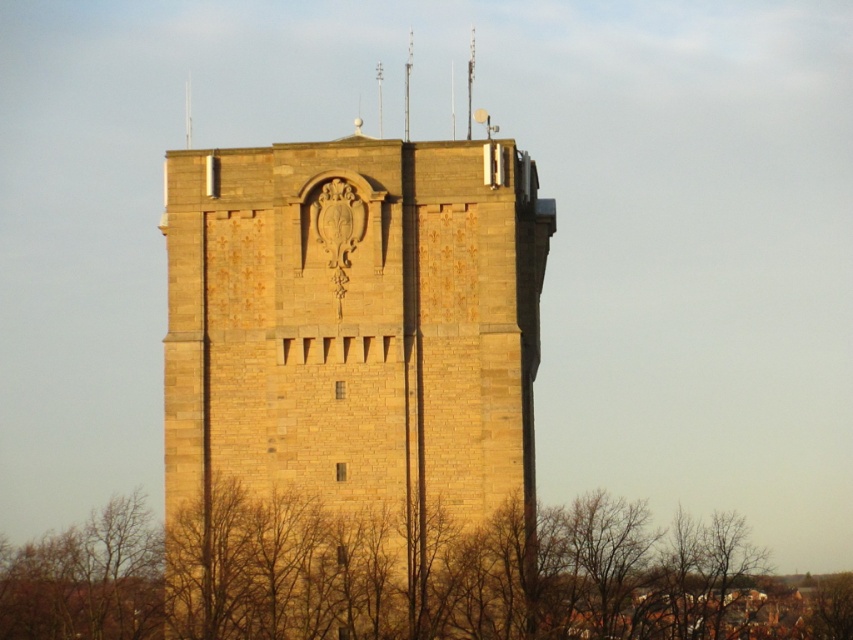
Which is more to the right, golden stone tower at center or brown leafless branches at lower center?

brown leafless branches at lower center is more to the right.

Can you confirm if golden stone tower at center is positioned below brown leafless branches at lower center?

Actually, golden stone tower at center is above brown leafless branches at lower center.

Describe the element at coordinates (352, 390) in the screenshot. I see `golden stone tower at center` at that location.

What are the coordinates of `golden stone tower at center` in the screenshot? It's located at (352, 390).